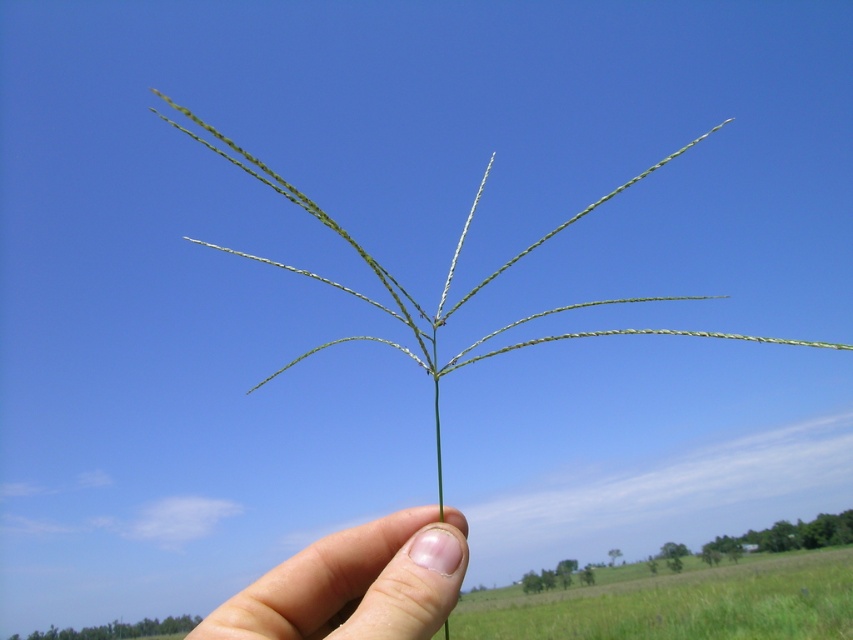
You are a photographer standing in the field shown in the image. You want to take a photo of the green matte grass at center and the smooth skin at center. How far apart are these two objects in the scene?

The distance between the green matte grass at center and the smooth skin at center is 23.02 meters.

You are a botanist examining a plant stem held in the hand. You notice the green matte grass at center and the smooth skin at center. Which object has a wider width?

The green matte grass at center might be wider than smooth skin at center.

Consider the image. You are a photographer taking a picture of the hand holding the plant stem. You want to focus on the point closer to the camera. Which point should you choose between point (839, 580) and point (444, 572)?

Point (839, 580) is further to the viewer than point (444, 572), so you should choose point (839, 580) to focus on the point closer to the camera.